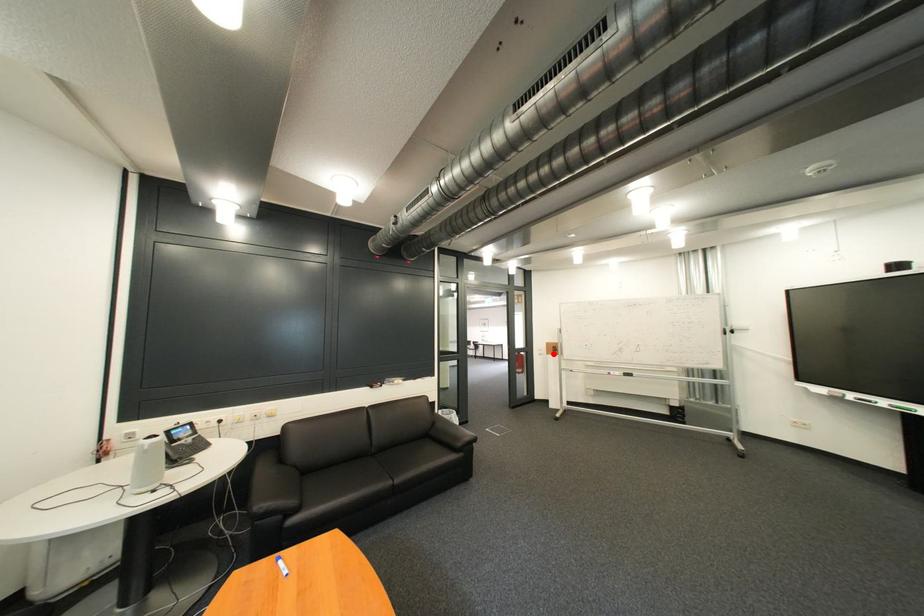
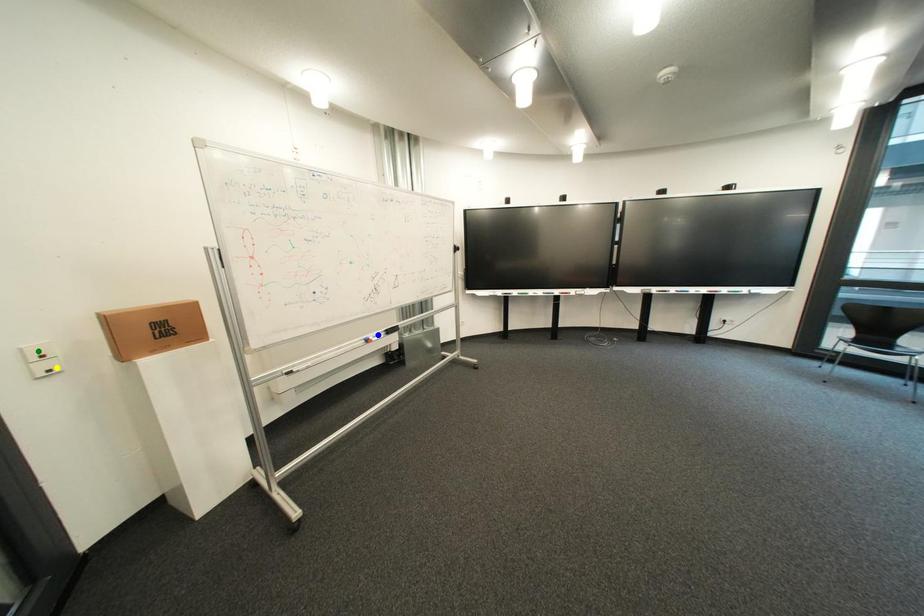
Question: I am providing you with two images of the same scene from different viewpoints. A red point is marked on the first image. You are given multiple points on the second image. In image 2, which mark is for the same physical point as the one in image 1?

Choices:
 (A) green point
 (B) blue point
 (C) yellow point

Answer: (C)